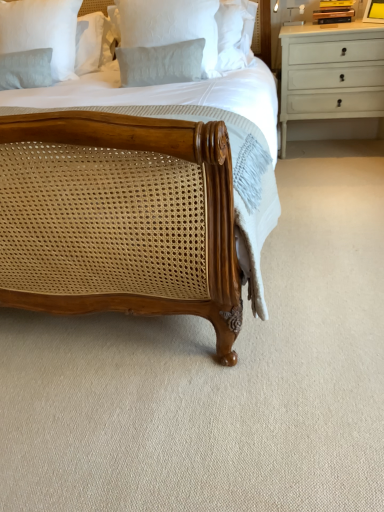
I want to click on vacant space positioned to the left of yellow matte picture frame at upper right, so click(366, 20).